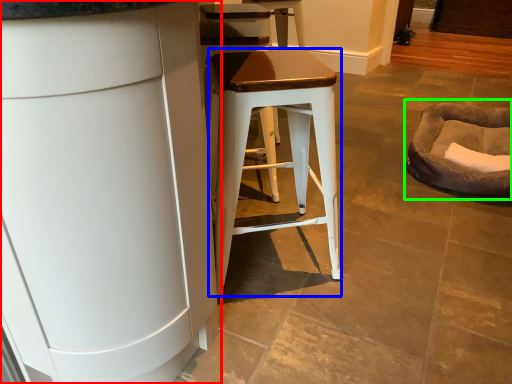
Question: Which object is positioned closest to cabinetry (highlighted by a red box)? Select from stool (highlighted by a blue box) and bean bag chair (highlighted by a green box).

Choices:
 (A) stool
 (B) bean bag chair

Answer: (A)